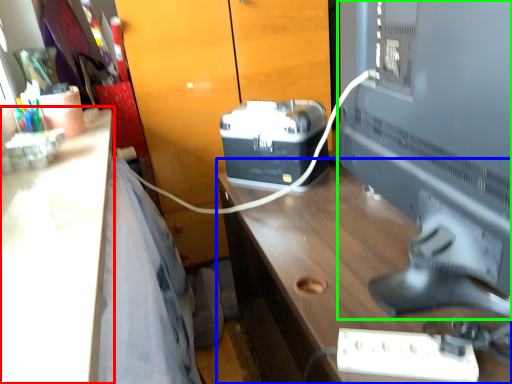
Question: Which object is the closest to the desk (highlighted by a red box)? Choose among these: desk (highlighted by a blue box) or desktop computer (highlighted by a green box).

Choices:
 (A) desk
 (B) desktop computer

Answer: (A)